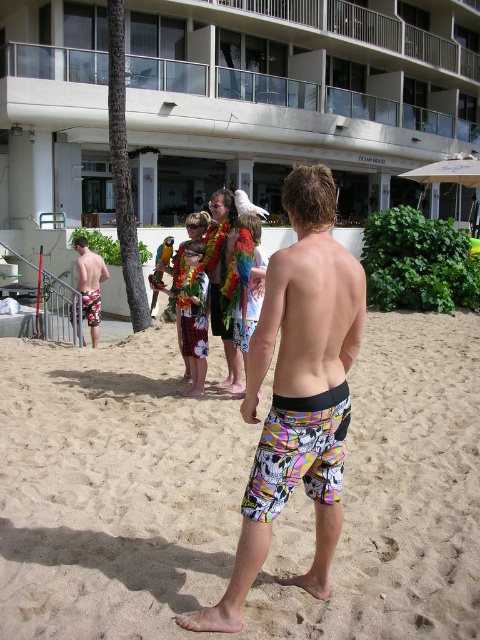
Question: Does white concrete building at center appear on the left side of printed fabric shorts at center?

Choices:
 (A) no
 (B) yes

Answer: (A)

Question: Which of the following is the closest to the observer?

Choices:
 (A) white concrete building at center
 (B) multicolored board shorts at center

Answer: (B)

Question: Which of these objects is positioned closest to the multicolored board shorts at center?

Choices:
 (A) printed fabric shorts at center
 (B) white concrete building at center

Answer: (A)

Question: Does printed fabric shorts at center have a smaller size compared to multicolored board shorts at left?

Choices:
 (A) no
 (B) yes

Answer: (A)

Question: Which object appears closest to the camera in this image?

Choices:
 (A) multicolored board shorts at center
 (B) printed fabric shorts at center
 (C) multicolored board shorts at left
 (D) white concrete building at center

Answer: (B)

Question: Considering the relative positions of printed fabric shorts at center and multicolored board shorts at center in the image provided, where is printed fabric shorts at center located with respect to multicolored board shorts at center?

Choices:
 (A) left
 (B) right

Answer: (B)